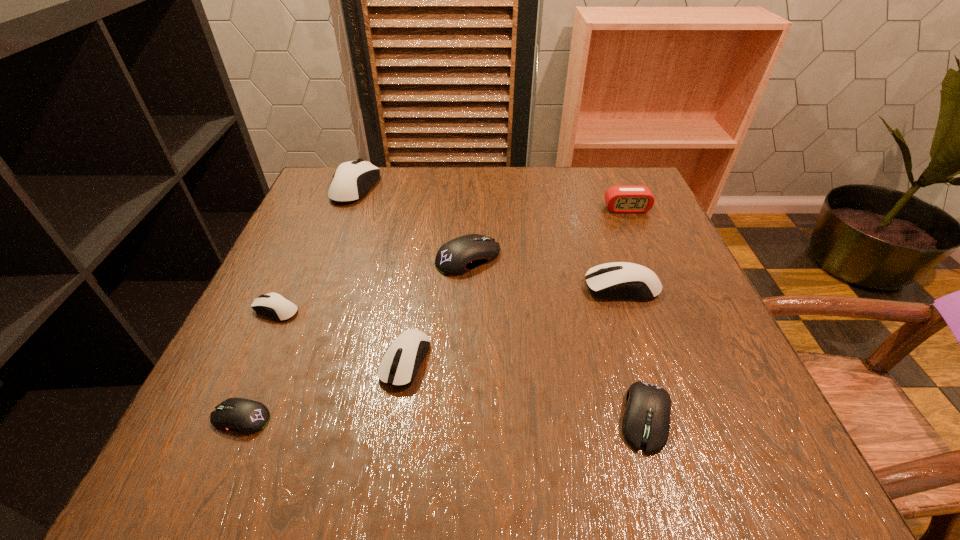
The image size is (960, 540). I want to click on vacant space at the far right corner, so click(x=606, y=205).

The height and width of the screenshot is (540, 960). In the image, there is a desktop. In order to click on blank space at the near right corner in this screenshot , I will do `click(749, 471)`.

This screenshot has width=960, height=540. I want to click on free space between the smallest black computer equipment and the farthest white mouse, so click(299, 302).

The width and height of the screenshot is (960, 540). I want to click on vacant space in between the rightmost black computer equipment and the farthest white mouse, so click(500, 302).

Where is `free spot between the farthest white mouse and the rightmost black computer equipment`? The width and height of the screenshot is (960, 540). free spot between the farthest white mouse and the rightmost black computer equipment is located at coordinates (500, 302).

You are a GUI agent. You are given a task and a screenshot of the screen. Output one action in this format:
    pyautogui.click(x=<x>, y=<y>)
    Task: Click on the free space that is in between the second biggest black computer equipment and the farthest white mouse
    This screenshot has height=540, width=960.
    Given the screenshot: What is the action you would take?
    pyautogui.click(x=500, y=302)

Locate an element on the screen. empty space that is in between the smallest black computer equipment and the rightmost black computer equipment is located at coordinates (444, 417).

You are a GUI agent. You are given a task and a screenshot of the screen. Output one action in this format:
    pyautogui.click(x=<x>, y=<y>)
    Task: Click on the free spot between the biggest black computer equipment and the pink alarm clock
    
    Given the screenshot: What is the action you would take?
    pyautogui.click(x=547, y=233)

The image size is (960, 540). Find the location of `blank region between the second black computer equipment from right to left and the smallest white mouse`. blank region between the second black computer equipment from right to left and the smallest white mouse is located at coordinates (372, 284).

Locate an element on the screen. free spot between the smallest black computer equipment and the second smallest black computer equipment is located at coordinates (444, 417).